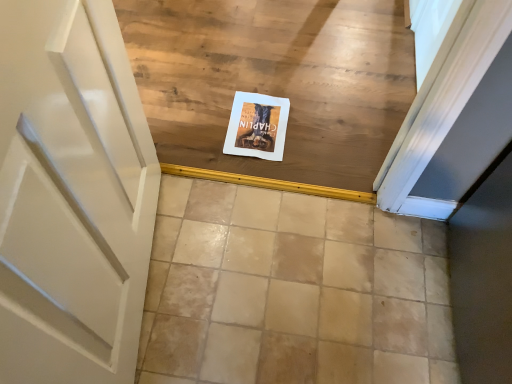
Identify the location of blank space above beige ceramic tile at center (from a real-world perspective). pos(312,290).